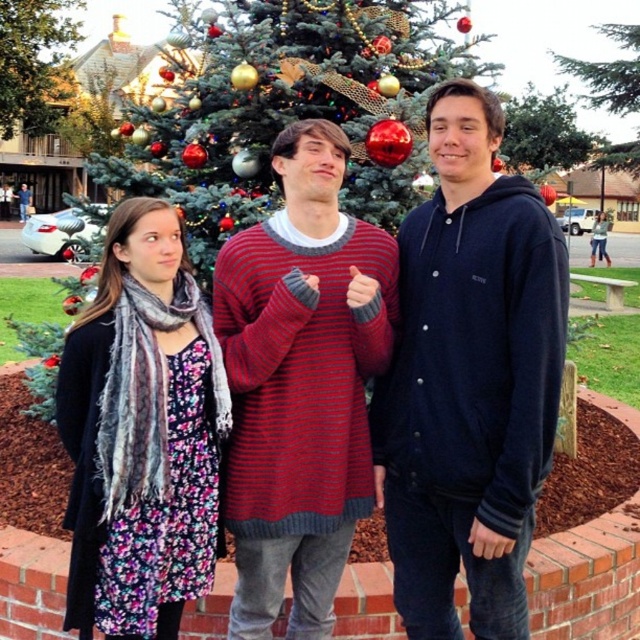
Question: Can you confirm if green leafy tree at upper center is positioned to the right of green textured pine tree at center?

Choices:
 (A) no
 (B) yes

Answer: (A)

Question: Is floral dress at center to the right of green textured pine tree at center from the viewer's perspective?

Choices:
 (A) no
 (B) yes

Answer: (A)

Question: Which point is closer to the camera taking this photo?

Choices:
 (A) (38, 42)
 (B) (618, 90)

Answer: (B)

Question: Which of the following is the farthest from the observer?

Choices:
 (A) green textured pine tree at center
 (B) striped knit sweater at center
 (C) decorated christmas tree at center
 (D) floral dress at center

Answer: (A)

Question: Which point is closer to the camera?

Choices:
 (A) (211, 35)
 (B) (428, 316)

Answer: (B)

Question: Does dark blue button-up hoodie at center come in front of green leafy tree at upper center?

Choices:
 (A) yes
 (B) no

Answer: (A)